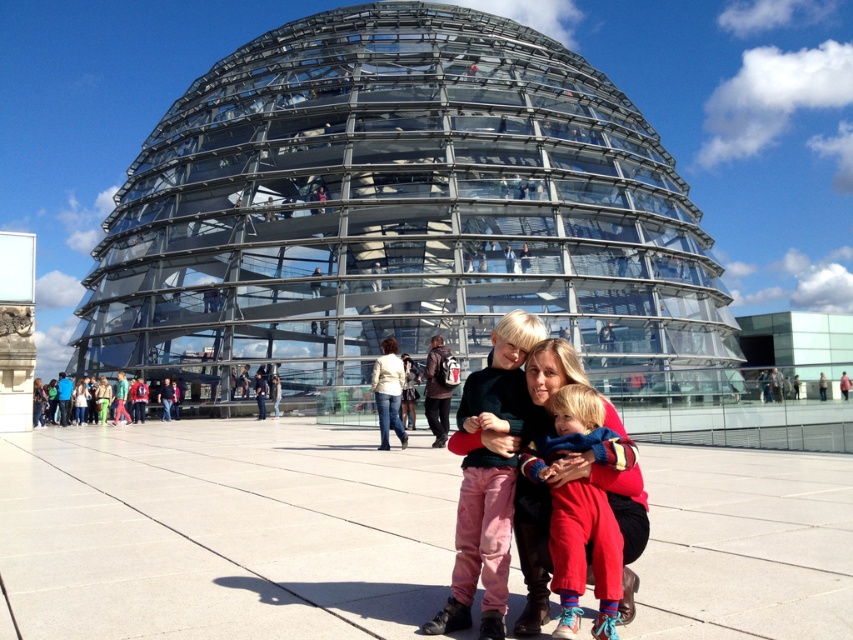
Can you confirm if knitted wool scarf at center is positioned to the left of denim jacket at center?

No, knitted wool scarf at center is not to the left of denim jacket at center.

Can you confirm if knitted wool scarf at center is shorter than denim jacket at center?

Correct, knitted wool scarf at center is not as tall as denim jacket at center.

Between point (576, 410) and point (390, 420), which one is positioned in front?

Point (576, 410) is more forward.

Identify the location of knitted wool scarf at center. The height and width of the screenshot is (640, 853). (585, 556).

Which is more to the right, dark green sweater at center or denim jacket at center?

dark green sweater at center is more to the right.

Which is in front, point (477, 502) or point (387, 449)?

Point (477, 502) is in front.

Which is behind, point (502, 611) or point (383, 420)?

Point (383, 420)

Where is `dark green sweater at center`? dark green sweater at center is located at coordinates (489, 476).

Can you confirm if dark green sweater at center is positioned above knitted wool scarf at center?

Incorrect, dark green sweater at center is not positioned above knitted wool scarf at center.

Which is above, dark green sweater at center or knitted wool scarf at center?

knitted wool scarf at center is higher up.

This screenshot has height=640, width=853. Identify the location of dark green sweater at center. (489, 476).